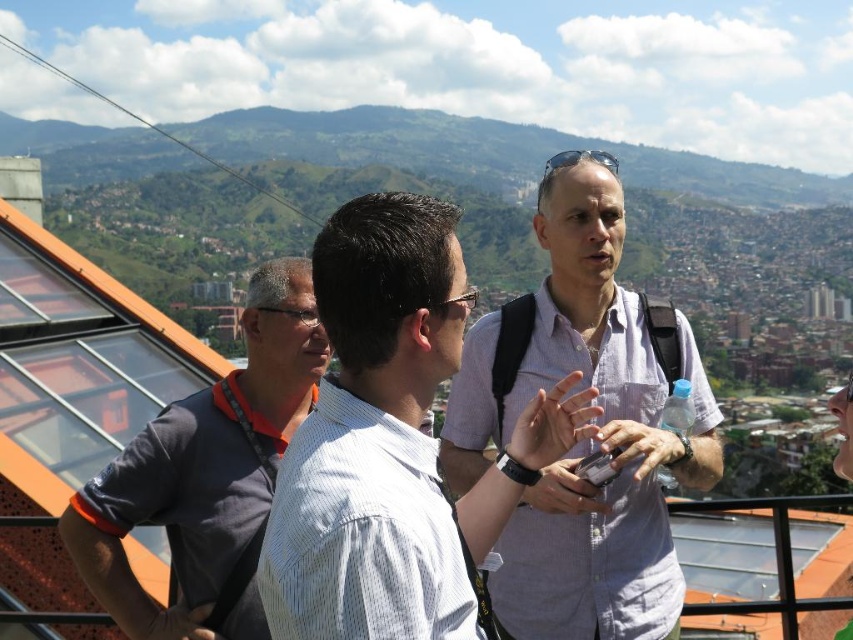
You are trying to determine who is closer to you based on their sizes. You see the white striped shirt at center and the gray fabric shirt at left. Which one is closer?

The white striped shirt at center is larger in size than the gray fabric shirt at left, so it is closer to you.

You are trying to decide who to approach first between the white striped shirt at center and the light purple shirt at center based on their positions. Which one is more to the left?

The white striped shirt at center is positioned on the left side of light purple shirt at center, so the white striped shirt at center is more to the left.

You are a photographer trying to capture a group photo of the light purple shirt at center and the gray fabric shirt at left. If you want to ensure both subjects are in focus, which one should you adjust the camera focus towards first?

The light purple shirt at center has a larger width than the gray fabric shirt at left, so you should adjust the camera focus towards the light purple shirt at center first to ensure both are in focus.